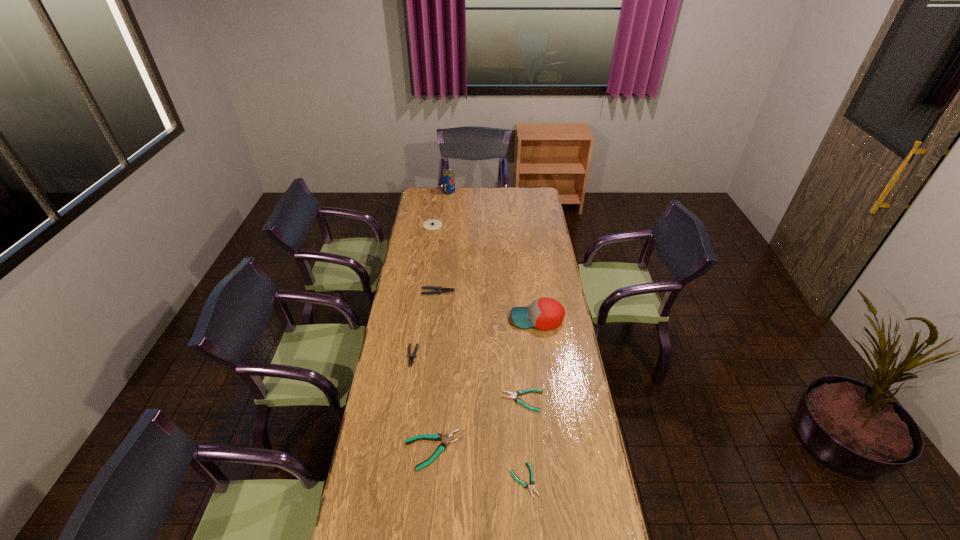
Where is `blank region between the fifth nearest object and the sixth tallest object`? This screenshot has height=540, width=960. blank region between the fifth nearest object and the sixth tallest object is located at coordinates (485, 384).

Locate an element on the screen. This screenshot has width=960, height=540. empty space between the shortest object and the fifth nearest object is located at coordinates (531, 400).

Where is `vacant region between the blue compass and the farthest object`? The image size is (960, 540). vacant region between the blue compass and the farthest object is located at coordinates [441, 208].

Image resolution: width=960 pixels, height=540 pixels. I want to click on free area in between the nearer gray pliers and the seventh tallest object, so click(x=468, y=379).

Where is `free space between the third shortest object and the farther gray pliers`? This screenshot has width=960, height=540. free space between the third shortest object and the farther gray pliers is located at coordinates (436, 371).

Point out which object is positioned as the nearest to the soda. Please provide its 2D coordinates. Your answer should be formatted as a tuple, i.e. [(x, y)], where the tuple contains the x and y coordinates of a point satisfying the conditions above.

[(433, 224)]

Where is `object that ranks as the fifth closest to the sixth tallest object`? object that ranks as the fifth closest to the sixth tallest object is located at coordinates (438, 290).

The width and height of the screenshot is (960, 540). What are the coordinates of `pliers that is the fourth closest to the smaller gray pliers` in the screenshot? It's located at (532, 481).

The width and height of the screenshot is (960, 540). What are the coordinates of `pliers that is the fourth closest to the farthest object` in the screenshot? It's located at (446, 439).

In order to click on the third closest teal pliers to the fourth nearest pliers in this screenshot , I will do `click(532, 481)`.